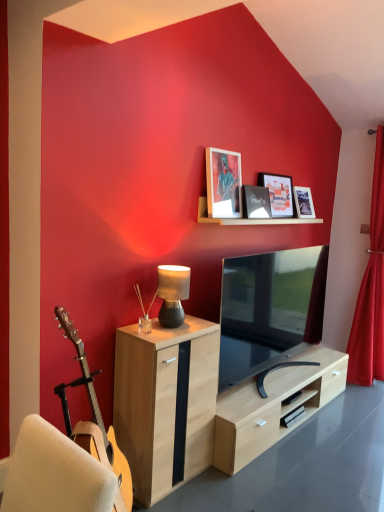
Question: Can you confirm if beech wood desk at lower center is taller than matte black tv at center?

Choices:
 (A) no
 (B) yes

Answer: (A)

Question: Is beech wood desk at lower center smaller than matte black tv at center?

Choices:
 (A) no
 (B) yes

Answer: (B)

Question: Does beech wood desk at lower center have a lesser width compared to matte black tv at center?

Choices:
 (A) yes
 (B) no

Answer: (B)

Question: Is beech wood desk at lower center further to camera compared to matte black tv at center?

Choices:
 (A) no
 (B) yes

Answer: (A)

Question: Could you tell me if beech wood desk at lower center is turned towards matte black tv at center?

Choices:
 (A) yes
 (B) no

Answer: (B)

Question: From the image's perspective, would you say beech wood desk at lower center is positioned over matte black tv at center?

Choices:
 (A) no
 (B) yes

Answer: (A)

Question: Is matte black lamp at center completely or partially outside of light wood cabinet at center?

Choices:
 (A) yes
 (B) no

Answer: (A)

Question: Considering the relative sizes of matte black lamp at center and light wood cabinet at center in the image provided, is matte black lamp at center thinner than light wood cabinet at center?

Choices:
 (A) no
 (B) yes

Answer: (B)

Question: From a real-world perspective, does matte black lamp at center sit lower than light wood cabinet at center?

Choices:
 (A) no
 (B) yes

Answer: (A)

Question: Can you confirm if matte black lamp at center is wider than light wood cabinet at center?

Choices:
 (A) no
 (B) yes

Answer: (A)

Question: Is light wood cabinet at center at the back of matte black lamp at center?

Choices:
 (A) no
 (B) yes

Answer: (A)

Question: Does matte black lamp at center have a smaller size compared to light wood cabinet at center?

Choices:
 (A) no
 (B) yes

Answer: (B)

Question: From the image's perspective, does matte black lamp at center appear lower than matte black tv at center?

Choices:
 (A) yes
 (B) no

Answer: (B)